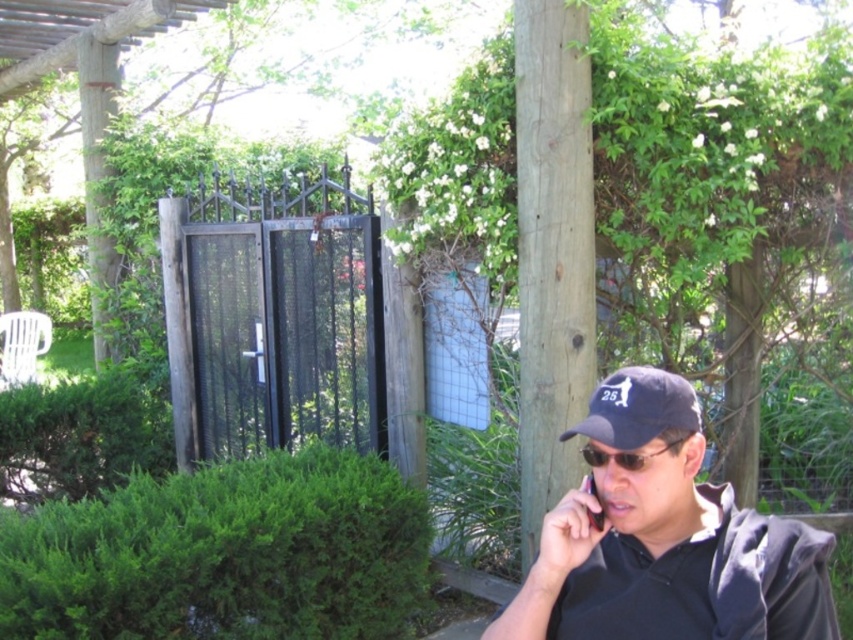
You are a photographer trying to capture both the matte black cap at center and the navy blue fabric baseball cap at upper right in a single shot. Which cap should you adjust your camera to focus on first to ensure both are in frame?

The matte black cap at center is positioned on the right side of navy blue fabric baseball cap at upper right, so you should focus on the navy blue fabric baseball cap at upper right first to ensure both are in frame.

You are a photographer trying to capture both the matte black cap at center and the navy blue fabric baseball cap at upper right in the same frame. Which cap should you adjust your camera angle to look up at to include both?

To include both the matte black cap at center and the navy blue fabric baseball cap at upper right in the frame, you should adjust your camera angle to look up at the navy blue fabric baseball cap at upper right since it is positioned above the matte black cap at center.

You are a photographer trying to capture the man in the scene. You want to ensure both the matte black cap at center and the black plastic phone at lower right are visible in your shot. Based on their positions, which object should you focus on first to frame the shot properly?

The matte black cap at center is located below the black plastic phone at lower right, so you should focus on the black plastic phone at lower right first to ensure both are in frame.